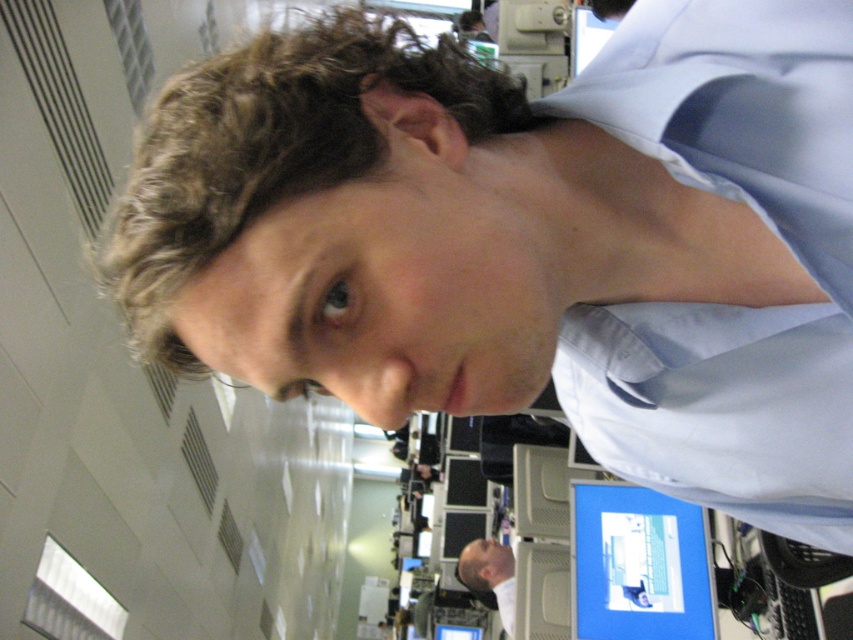
You are an office worker who needs to adjust the blue glossy monitor at lower right so that it is no longer blocking the view of the smooth bald head at lower center. How should you move the monitor?

The blue glossy monitor at lower right is currently in front of the smooth bald head at lower center. To unblock the view, move the monitor backward away from the smooth bald head at lower center.

You are an interior designer assessing the placement of items in an office space. You notice the light blue satin dress shirt at upper right and the blue glossy monitor at lower right. Which object is positioned higher in the image?

The light blue satin dress shirt at upper right is positioned higher in the image than the blue glossy monitor at lower right because it is located at the upper right area, while the monitor is at the lower right.